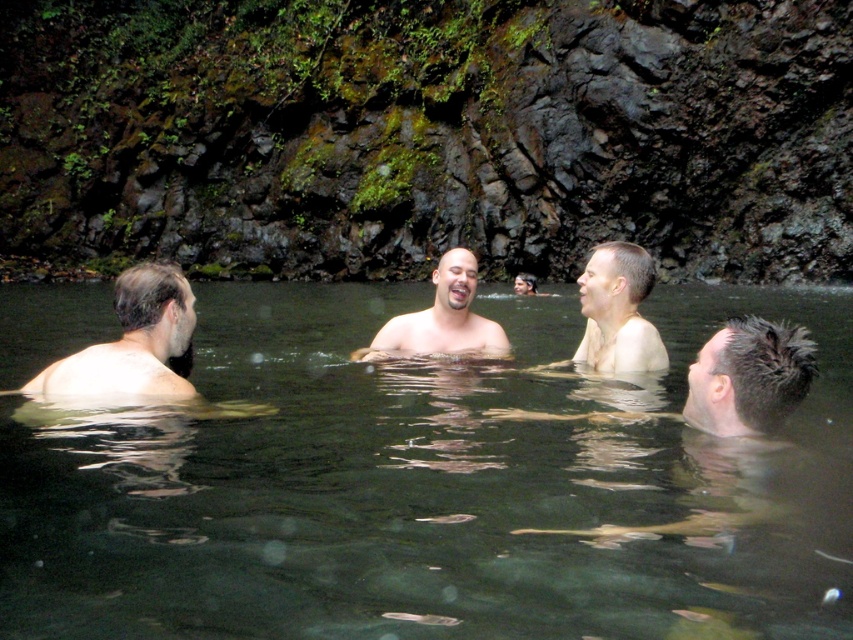
You are a photographer standing at the edge of the hot spring. You want to capture a clear shot of the smooth skin man at center without the transparent water at center obstructing the view. Is this possible?

The transparent water at center is positioned under the smooth skin man at center, so it is possible to capture a clear shot of the smooth skin man at center without the water obstructing the view since the water is beneath him.

Consider the image. You are a photographer planning to capture a group photo of the individuals in the transparent water at center and light brown skin at center. Given that the water is wider than the group, will you position the camera to the side or behind to best frame the entire group?

Since the transparent water at center is wider than the light brown skin at center, positioning the camera to the side would allow capturing the entire group within the frame.